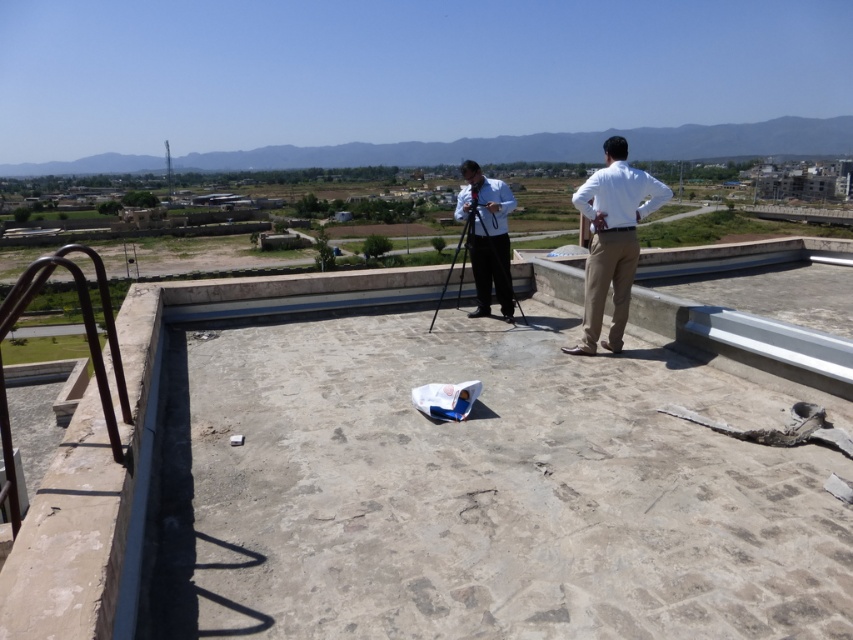
Question: Which object is farther from the camera taking this photo?

Choices:
 (A) white cotton shirt at right
 (B) metallic tripod at center

Answer: (B)

Question: Can you confirm if white cotton shirt at right is wider than metallic tripod at center?

Choices:
 (A) no
 (B) yes

Answer: (B)

Question: Does white cotton shirt at right have a greater width compared to metallic tripod at center?

Choices:
 (A) yes
 (B) no

Answer: (A)

Question: Is the position of white cotton shirt at right more distant than that of metallic tripod at center?

Choices:
 (A) yes
 (B) no

Answer: (B)